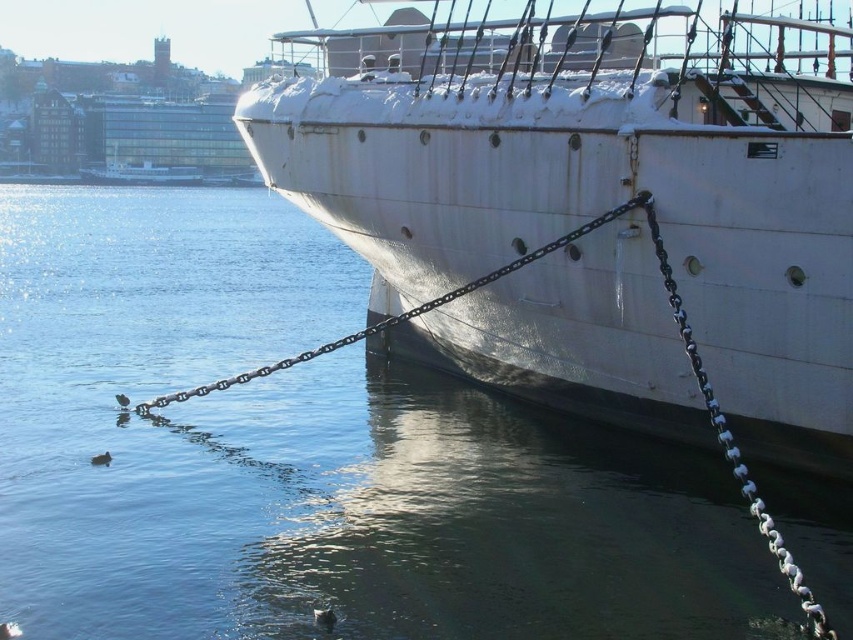
Does silver metallic chain at right appear on the left side of metallic chain at lower center?

In fact, silver metallic chain at right is to the right of metallic chain at lower center.

Does silver metallic chain at right have a larger size compared to metallic chain at lower center?

No, silver metallic chain at right is not bigger than metallic chain at lower center.

The image size is (853, 640). Find the location of `silver metallic chain at right`. silver metallic chain at right is located at coordinates (730, 436).

Find the location of a particular element. silver metallic chain at right is located at coordinates (730, 436).

Is the position of clear water at lower left less distant than that of silver metallic chain at right?

No, clear water at lower left is behind silver metallic chain at right.

From the picture: Between clear water at lower left and silver metallic chain at right, which one appears on the right side from the viewer's perspective?

Positioned to the right is silver metallic chain at right.

Locate an element on the screen. clear water at lower left is located at coordinates (310, 458).

Does white matte ship at center appear on the right side of silver metallic chain at right?

No, white matte ship at center is not to the right of silver metallic chain at right.

Is point (358, 225) farther from camera compared to point (807, 593)?

Yes, it is.

Where is `white matte ship at center`? white matte ship at center is located at coordinates (595, 182).